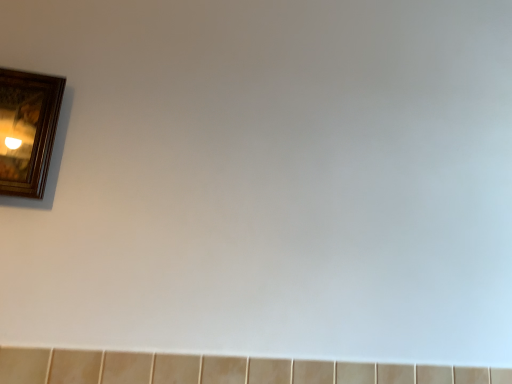
Where is `wooden frame at upper left`? wooden frame at upper left is located at coordinates (27, 130).

What do you see at coordinates (27, 130) in the screenshot? Image resolution: width=512 pixels, height=384 pixels. I see `wooden frame at upper left` at bounding box center [27, 130].

Where is `wooden frame at upper left`? This screenshot has width=512, height=384. wooden frame at upper left is located at coordinates tap(27, 130).